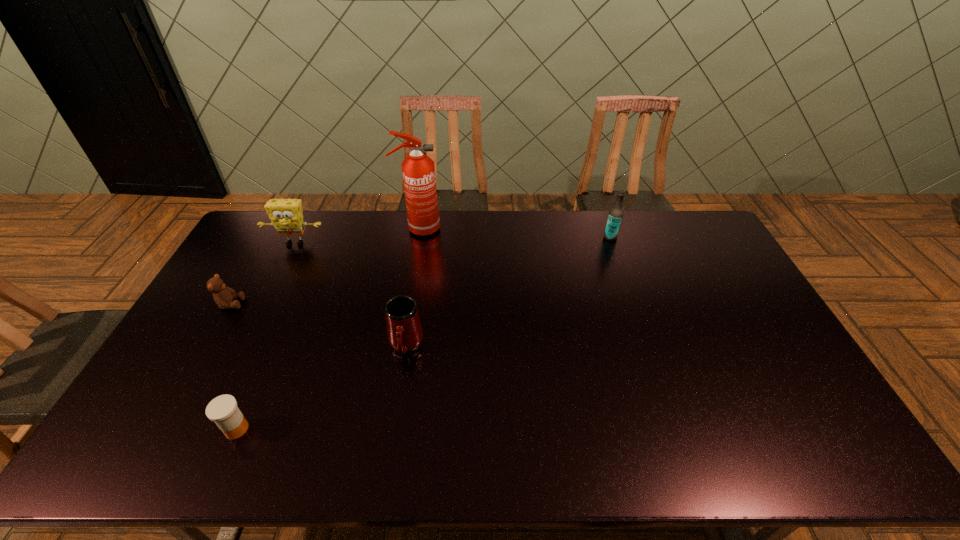
The width and height of the screenshot is (960, 540). I want to click on free area in between the fire extinguisher and the teddy bear, so click(324, 267).

This screenshot has height=540, width=960. Identify the location of blank region between the tallest object and the teddy bear. (324, 267).

The width and height of the screenshot is (960, 540). In order to click on vacant space that's between the sponge and the tallest object in this screenshot , I will do `click(356, 236)`.

At what (x,y) coordinates should I click in order to perform the action: click on free space between the third nearest object and the mug. Please return your answer as a coordinate pair (x, y). The width and height of the screenshot is (960, 540). Looking at the image, I should click on (318, 325).

This screenshot has height=540, width=960. Identify the location of free space that is in between the teddy bear and the fourth tallest object. (318, 325).

Choose which object is the second nearest neighbor to the mug. Please provide its 2D coordinates. Your answer should be formatted as a tuple, i.e. [(x, y)], where the tuple contains the x and y coordinates of a point satisfying the conditions above.

[(418, 170)]

This screenshot has height=540, width=960. I want to click on object that is the fourth closest to the third nearest object, so click(418, 170).

The image size is (960, 540). Find the location of `vacant region that satisfies the following two spatial constraints: 1. at the nozzle of the tallest object; 2. on the face of the sponge`. vacant region that satisfies the following two spatial constraints: 1. at the nozzle of the tallest object; 2. on the face of the sponge is located at coordinates (416, 243).